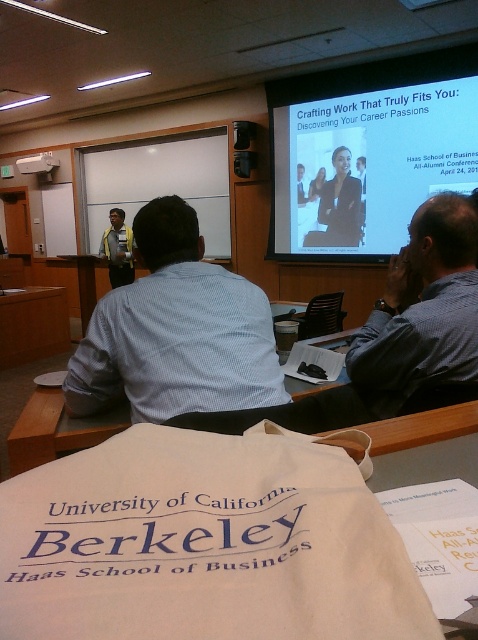
You are an event organizer who needs to ensure that all participants can see the presentation clearly. Considering the yellow shirt at center and the white plastic projector at upper center, which object is wider and might block the view if positioned improperly?

The white plastic projector at upper center is wider than the yellow shirt at center, so it might block the view if positioned improperly.

In the scene shown: You are an attendee at the lecture and notice both the blue shirt at upper center and the whiteboard at upper center. Which object appears larger in the image?

The whiteboard at upper center appears larger because the blue shirt at upper center is smaller than it.

You are an attendee at the Haas School of Business event. You notice a yellow shirt at center and a white plastic projector at upper center. Which object is located lower in the image?

The yellow shirt at center is positioned under the white plastic projector at upper center, so it is located lower in the image.